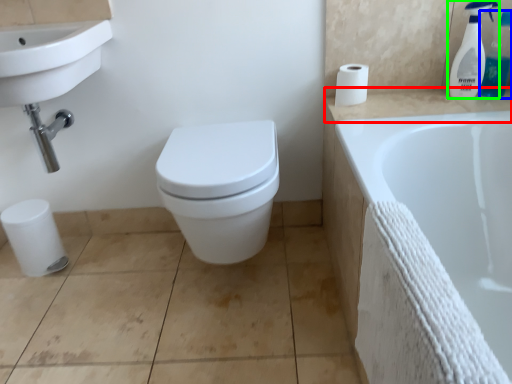
Question: Which is nearer to the counter top (highlighted by a red box)? cleaning product (highlighted by a blue box) or cleaning product (highlighted by a green box).

Choices:
 (A) cleaning product
 (B) cleaning product

Answer: (B)